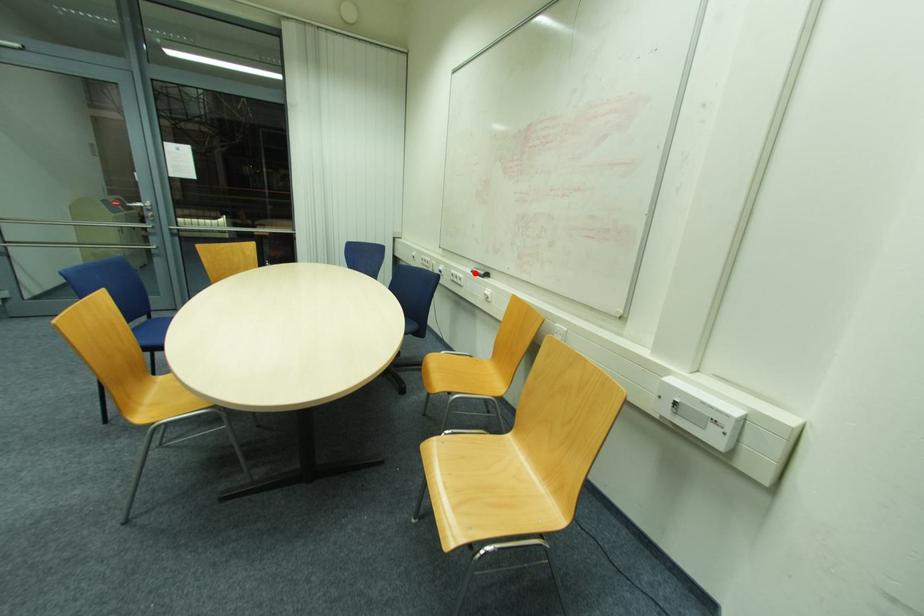
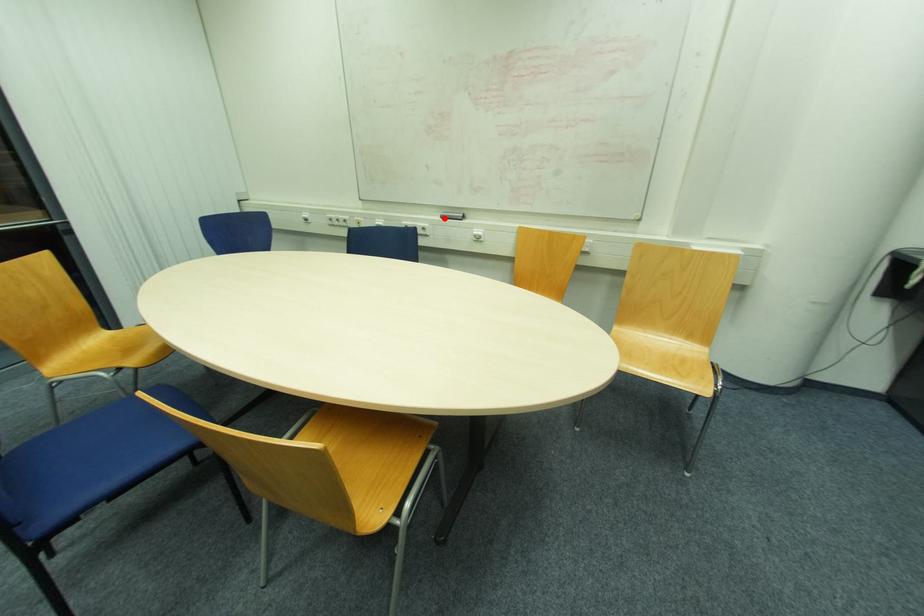
I am providing you with two images of the same scene from different viewpoints. A red point is marked on the first image and another point is marked on the second image. Does the point marked in image1 correspond to the same location as the one in image2?

Yes